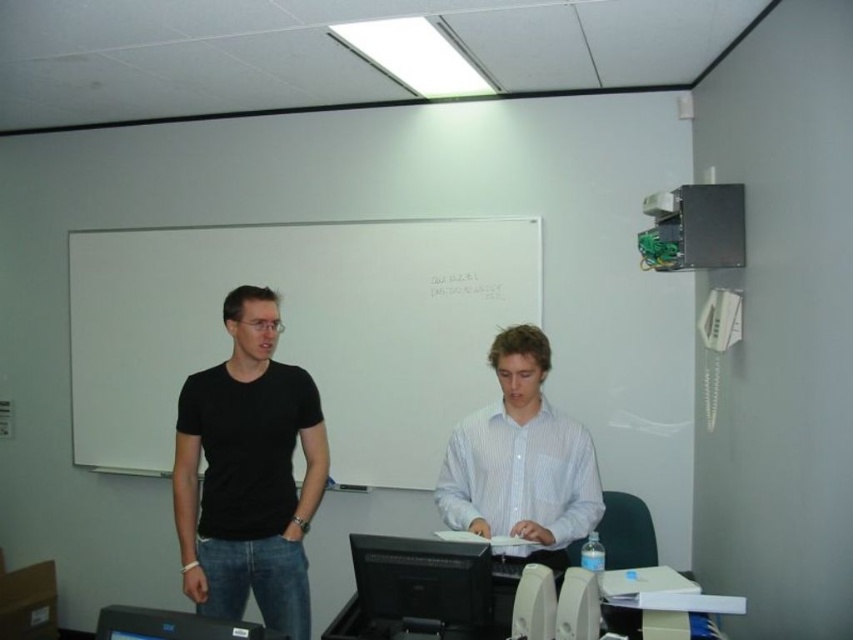
Question: Which object appears closest to the camera in this image?

Choices:
 (A) white plastic printer at lower center
 (B) white striped shirt at center

Answer: (A)

Question: Which point is closer to the camera?

Choices:
 (A) (403, 552)
 (B) (502, 490)

Answer: (A)

Question: Is white striped shirt at center behind black plastic printer at lower center?

Choices:
 (A) yes
 (B) no

Answer: (A)

Question: Which point is farther from the camera taking this photo?

Choices:
 (A) (641, 570)
 (B) (380, 564)
 (C) (229, 500)

Answer: (C)

Question: Is white matte whiteboard at upper center to the right of white striped shirt at center from the viewer's perspective?

Choices:
 (A) yes
 (B) no

Answer: (B)

Question: Is white striped shirt at center above black glossy monitor at center?

Choices:
 (A) yes
 (B) no

Answer: (A)